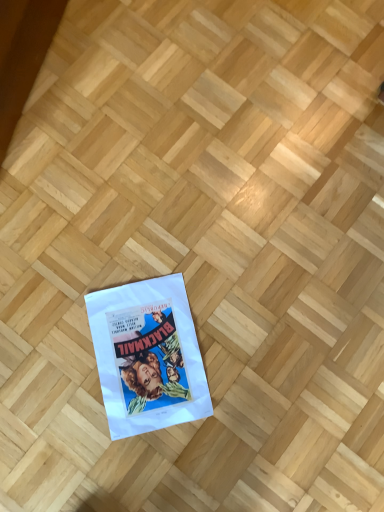
The image size is (384, 512). I want to click on vacant region above white paper at center (from a real-world perspective), so click(x=153, y=350).